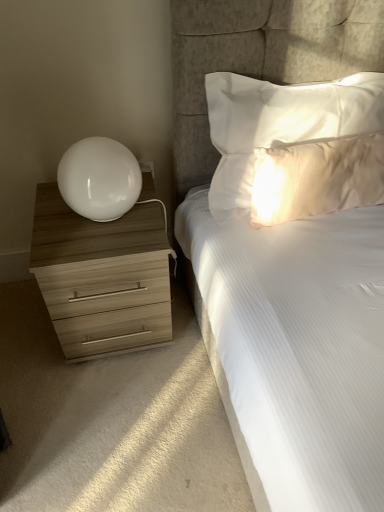
In order to click on free spot to the left of wooden chest of drawers at left in this screenshot , I will do `click(25, 330)`.